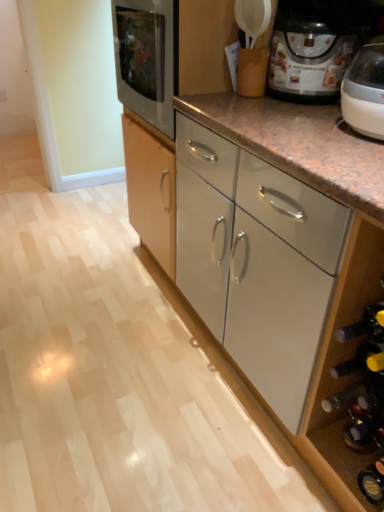
Identify the location of matte black coffee maker at upper right. (312, 48).

This screenshot has width=384, height=512. I want to click on white glossy cabinet at center, so click(x=284, y=260).

Identify the location of matte black wine bottle at lower right. This screenshot has width=384, height=512. (356, 360).

Can you confirm if matte black coffee maker at upper right is taller than white glossy cabinet at center?

Indeed, matte black coffee maker at upper right has a greater height compared to white glossy cabinet at center.

From the image's perspective, is matte black coffee maker at upper right above or below white glossy cabinet at center?

Based on their image positions, matte black coffee maker at upper right is located above white glossy cabinet at center.

Are matte black coffee maker at upper right and white glossy cabinet at center beside each other?

No, matte black coffee maker at upper right is not with white glossy cabinet at center.

From a real-world perspective, is matte black coffee maker at upper right beneath white glossy cabinet at center?

No, from a real-world perspective, matte black coffee maker at upper right is not under white glossy cabinet at center.

Considering the sizes of objects white glossy cabinet at center and matte black wine bottle at lower right in the image provided, who is shorter, white glossy cabinet at center or matte black wine bottle at lower right?

With less height is white glossy cabinet at center.

Can you confirm if white glossy cabinet at center is smaller than matte black wine bottle at lower right?

Actually, white glossy cabinet at center might be larger than matte black wine bottle at lower right.

Between white glossy cabinet at center and matte black wine bottle at lower right, which one has smaller width?

matte black wine bottle at lower right.

Considering the sizes of objects white glossy cabinet at center and matte black coffee maker at upper right in the image provided, who is shorter, white glossy cabinet at center or matte black coffee maker at upper right?

Standing shorter between the two is white glossy cabinet at center.

Which is more to the left, white glossy cabinet at center or matte black coffee maker at upper right?

white glossy cabinet at center.

From the image's perspective, is white glossy cabinet at center located above matte black coffee maker at upper right?

No, from the image's perspective, white glossy cabinet at center is not on top of matte black coffee maker at upper right.

Which of these two, matte black coffee maker at upper right or matte black wine bottle at lower right, is smaller?

Smaller between the two is matte black wine bottle at lower right.

How much distance is there between matte black coffee maker at upper right and matte black wine bottle at lower right?

The distance of matte black coffee maker at upper right from matte black wine bottle at lower right is 84.00 centimeters.

Who is taller, matte black coffee maker at upper right or matte black wine bottle at lower right?

With more height is matte black coffee maker at upper right.

Considering the positions of points (320, 28) and (357, 364), is point (320, 28) closer to camera compared to point (357, 364)?

That is False.

From the picture: Could you tell me if matte black wine bottle at lower right is facing matte black coffee maker at upper right?

No.

Considering the relative positions of matte black wine bottle at lower right and matte black coffee maker at upper right in the image provided, is matte black wine bottle at lower right to the right of matte black coffee maker at upper right from the viewer's perspective?

No.

Between matte black wine bottle at lower right and matte black coffee maker at upper right, which one has less height?

Standing shorter between the two is matte black wine bottle at lower right.

Which object is further away from the camera taking this photo, matte black wine bottle at lower right or matte black coffee maker at upper right?

matte black coffee maker at upper right is more distant.

Is matte black wine bottle at lower right positioned with its back to white glossy cabinet at center?

No, matte black wine bottle at lower right's orientation is not away from white glossy cabinet at center.

Image resolution: width=384 pixels, height=512 pixels. Find the location of `wine bottle below the white glossy cabinet at center (from the image's perspective)`. wine bottle below the white glossy cabinet at center (from the image's perspective) is located at coordinates (x=356, y=360).

Does matte black wine bottle at lower right appear on the right side of white glossy cabinet at center?

Yes, matte black wine bottle at lower right is to the right of white glossy cabinet at center.

Considering the sizes of matte black wine bottle at lower right and white glossy cabinet at center in the image, is matte black wine bottle at lower right wider or thinner than white glossy cabinet at center?

Considering their sizes, matte black wine bottle at lower right looks slimmer than white glossy cabinet at center.

The image size is (384, 512). I want to click on home appliance behind the white glossy cabinet at center, so click(x=312, y=48).

The height and width of the screenshot is (512, 384). What are the coordinates of `cabinetry on the left of matte black wine bottle at lower right` in the screenshot? It's located at (284, 260).

Considering their positions, is white glossy cabinet at center positioned closer to matte black coffee maker at upper right than matte black wine bottle at lower right?

white glossy cabinet at center is positioned closer to the anchor matte black coffee maker at upper right.

Estimate the real-world distances between objects in this image. Which object is closer to matte black wine bottle at lower right, matte black coffee maker at upper right or white glossy cabinet at center?

The object closer to matte black wine bottle at lower right is white glossy cabinet at center.

Considering their positions, is white glossy cabinet at center positioned closer to matte black wine bottle at lower right than matte black coffee maker at upper right?

white glossy cabinet at center is closer to matte black wine bottle at lower right.

When comparing their distances from white glossy cabinet at center, does matte black coffee maker at upper right or matte black wine bottle at lower right seem further?

Among the two, matte black wine bottle at lower right is located further to white glossy cabinet at center.

Considering their positions, is matte black wine bottle at lower right positioned closer to matte black coffee maker at upper right than white glossy cabinet at center?

Based on the image, white glossy cabinet at center appears to be nearer to matte black coffee maker at upper right.

When comparing their distances from white glossy cabinet at center, does matte black wine bottle at lower right or matte black coffee maker at upper right seem further?

Based on the image, matte black wine bottle at lower right appears to be further to white glossy cabinet at center.

The height and width of the screenshot is (512, 384). I want to click on cabinetry that lies between matte black coffee maker at upper right and matte black wine bottle at lower right from top to bottom, so click(x=284, y=260).